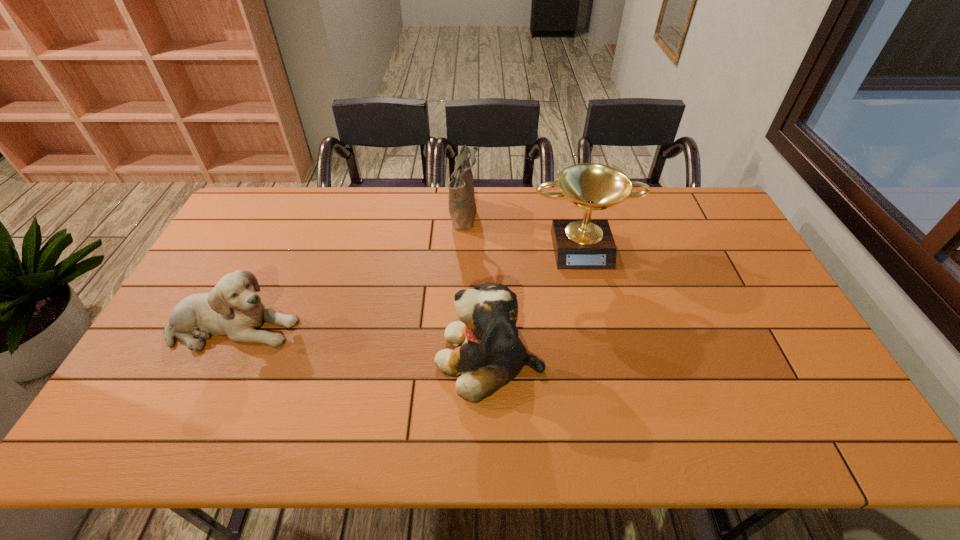
You are a GUI agent. You are given a task and a screenshot of the screen. Output one action in this format:
    pyautogui.click(x=<x>, y=<y>)
    Task: Click on the shoulder bag
    
    Given the screenshot: What is the action you would take?
    pyautogui.click(x=461, y=201)

Where is `the rightmost object`? The image size is (960, 540). the rightmost object is located at coordinates pos(586,243).

This screenshot has height=540, width=960. Find the location of `the right puppy`. the right puppy is located at coordinates (491, 354).

In order to click on the left puppy in this screenshot , I will do `click(233, 308)`.

The height and width of the screenshot is (540, 960). I want to click on the shorter puppy, so click(233, 308).

The height and width of the screenshot is (540, 960). In order to click on vacant space positioned 0.320m on the front-facing side of the shoulder bag in this screenshot , I will do `click(567, 211)`.

The image size is (960, 540). Identify the location of free space located 0.260m on the front-facing side of the award. (604, 337).

Find the location of a particular element. Image resolution: width=960 pixels, height=540 pixels. free region located 0.240m at the face of the right puppy is located at coordinates (344, 359).

Image resolution: width=960 pixels, height=540 pixels. Identify the location of blank space located 0.200m at the face of the right puppy. (359, 359).

You are a GUI agent. You are given a task and a screenshot of the screen. Output one action in this format:
    pyautogui.click(x=<x>, y=<y>)
    Task: Click on the vacant region located at the face of the right puppy
    This screenshot has height=540, width=960.
    Given the screenshot: What is the action you would take?
    pyautogui.click(x=355, y=359)